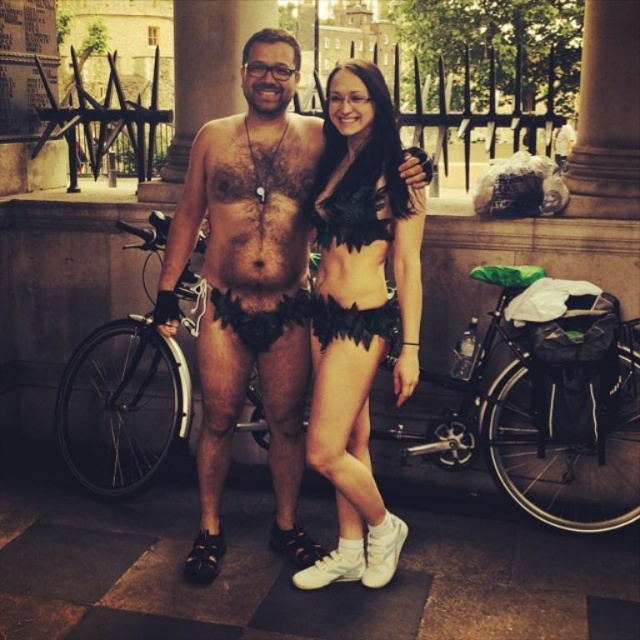
Question: Does black matte leafy bikini at center appear over black feathered bikini top at center?

Choices:
 (A) no
 (B) yes

Answer: (A)

Question: Is black matte leafy bikini at center positioned in front of black feathered bikini top at center?

Choices:
 (A) yes
 (B) no

Answer: (A)

Question: Which point appears farthest from the camera in this image?

Choices:
 (A) (385, 228)
 (B) (365, 209)
 (C) (172, 321)

Answer: (C)

Question: Can you confirm if leather shorts at center is wider than black feathered bikini top at center?

Choices:
 (A) no
 (B) yes

Answer: (B)

Question: Among these objects, which one is nearest to the camera?

Choices:
 (A) leather shorts at center
 (B) black feathered bikini top at center
 (C) black matte leafy bikini at center

Answer: (A)

Question: Which point appears farthest from the camera in this image?

Choices:
 (A) (316, 456)
 (B) (250, 252)

Answer: (B)